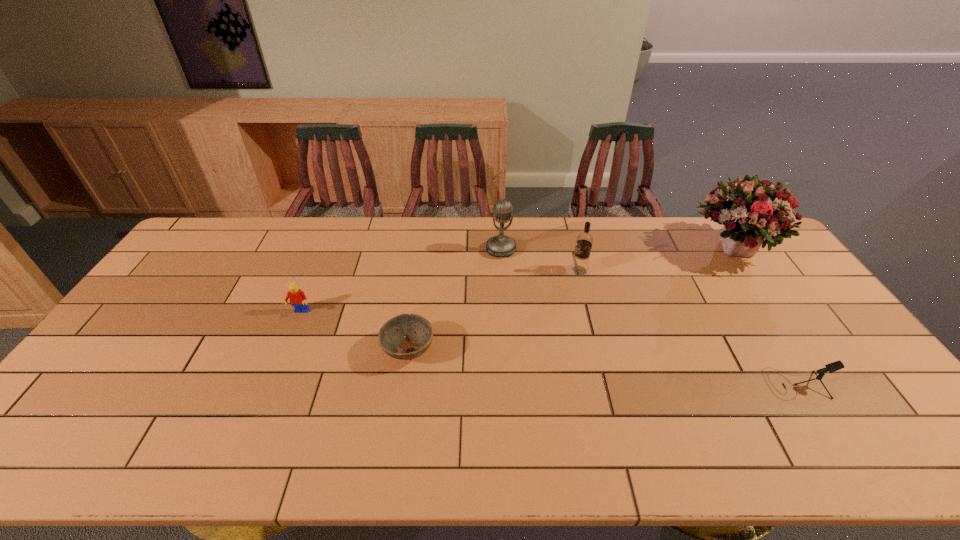
This screenshot has height=540, width=960. What are the coordinates of `bouquet located at the far edge` in the screenshot? It's located at (753, 212).

Where is `microphone present at the far edge`? This screenshot has height=540, width=960. microphone present at the far edge is located at coordinates (500, 245).

Find the location of `bouquet at the right edge`. bouquet at the right edge is located at coordinates (753, 212).

Where is `microphone present at the right edge`? The height and width of the screenshot is (540, 960). microphone present at the right edge is located at coordinates (834, 366).

Locate an element on the screen. object that is at the far right corner is located at coordinates (753, 212).

In the image, there is a desktop. What are the coordinates of `vacant space at the far edge` in the screenshot? It's located at (261, 219).

In the image, there is a desktop. What are the coordinates of `vacant space at the near edge` in the screenshot? It's located at (606, 462).

Image resolution: width=960 pixels, height=540 pixels. I want to click on free space at the left edge of the desktop, so click(x=204, y=267).

In the image, there is a desktop. Find the location of `free space at the far left corner`. free space at the far left corner is located at coordinates (222, 231).

Where is `free space between the Lego and the fifth object from right to left`? The width and height of the screenshot is (960, 540). free space between the Lego and the fifth object from right to left is located at coordinates (354, 331).